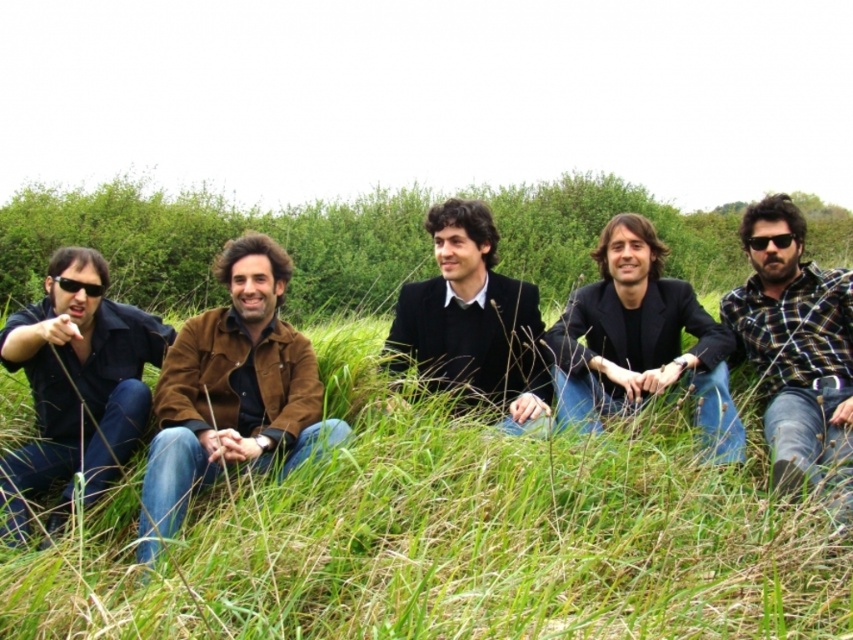
In the scene shown: Who is higher up, plaid flannel shirt at right or black matte suit at center?

black matte suit at center is higher up.

Who is shorter, plaid flannel shirt at right or black matte suit at center?

black matte suit at center is shorter.

The height and width of the screenshot is (640, 853). Describe the element at coordinates (798, 352) in the screenshot. I see `plaid flannel shirt at right` at that location.

Locate an element on the screen. plaid flannel shirt at right is located at coordinates (798, 352).

Can you confirm if green grassy at center is thinner than brown suede jacket at center?

Incorrect, green grassy at center's width is not less than brown suede jacket at center's.

Is green grassy at center to the right of brown suede jacket at center from the viewer's perspective?

Correct, you'll find green grassy at center to the right of brown suede jacket at center.

Does point (634, 598) lie in front of point (289, 429)?

That is True.

The height and width of the screenshot is (640, 853). What are the coordinates of `green grassy at center` in the screenshot? It's located at (456, 536).

Can you confirm if brown suede jacket at center is positioned below matte black shirt at left?

No.

Which is more to the right, brown suede jacket at center or matte black shirt at left?

brown suede jacket at center

What are the coordinates of `brown suede jacket at center` in the screenshot? It's located at (231, 390).